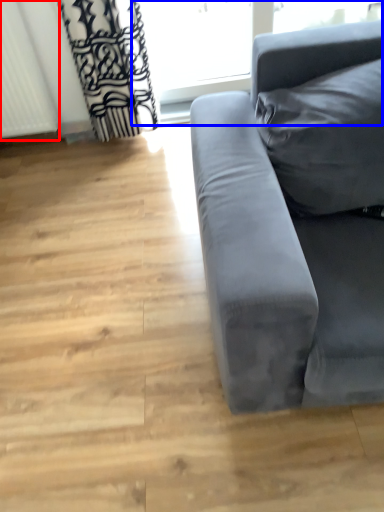
Question: Among these objects, which one is farthest to the camera, radiator (highlighted by a red box) or window frame (highlighted by a blue box)?

Choices:
 (A) radiator
 (B) window frame

Answer: (B)